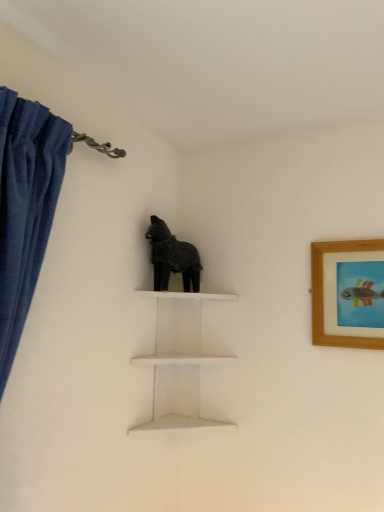
Question: Can you confirm if white matte shelf at center is taller than wooden framed picture at upper right?

Choices:
 (A) yes
 (B) no

Answer: (A)

Question: Is white matte shelf at center in contact with wooden framed picture at upper right?

Choices:
 (A) yes
 (B) no

Answer: (B)

Question: Can you confirm if white matte shelf at center is wider than wooden framed picture at upper right?

Choices:
 (A) yes
 (B) no

Answer: (A)

Question: Is white matte shelf at center facing towards wooden framed picture at upper right?

Choices:
 (A) no
 (B) yes

Answer: (B)

Question: Is white matte shelf at center positioned behind wooden framed picture at upper right?

Choices:
 (A) no
 (B) yes

Answer: (B)

Question: Is white matte shelf at center positioned far away from wooden framed picture at upper right?

Choices:
 (A) no
 (B) yes

Answer: (A)

Question: Is the position of wooden framed picture at upper right more distant than that of fuzzy black dog at center?

Choices:
 (A) yes
 (B) no

Answer: (B)

Question: From the image's perspective, is wooden framed picture at upper right above fuzzy black dog at center?

Choices:
 (A) yes
 (B) no

Answer: (B)

Question: Can you confirm if wooden framed picture at upper right is shorter than fuzzy black dog at center?

Choices:
 (A) no
 (B) yes

Answer: (A)

Question: Can fuzzy black dog at center be found inside wooden framed picture at upper right?

Choices:
 (A) yes
 (B) no

Answer: (B)

Question: Does wooden framed picture at upper right have a smaller size compared to fuzzy black dog at center?

Choices:
 (A) yes
 (B) no

Answer: (A)

Question: Considering the relative positions of wooden framed picture at upper right and fuzzy black dog at center in the image provided, is wooden framed picture at upper right to the right of fuzzy black dog at center from the viewer's perspective?

Choices:
 (A) yes
 (B) no

Answer: (A)

Question: Can you confirm if fuzzy black dog at center is positioned to the left of wooden framed picture at upper right?

Choices:
 (A) yes
 (B) no

Answer: (A)